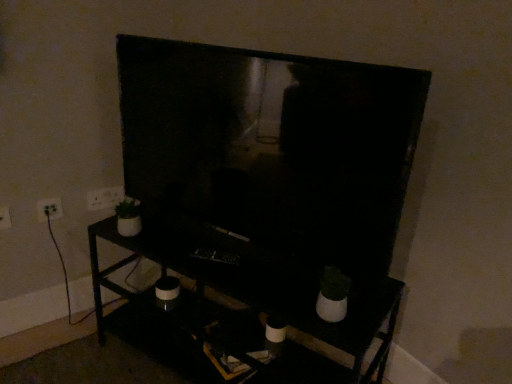
The image size is (512, 384). In order to click on free region under matte black tv at center (from a real-world perspective) in this screenshot , I will do `click(242, 251)`.